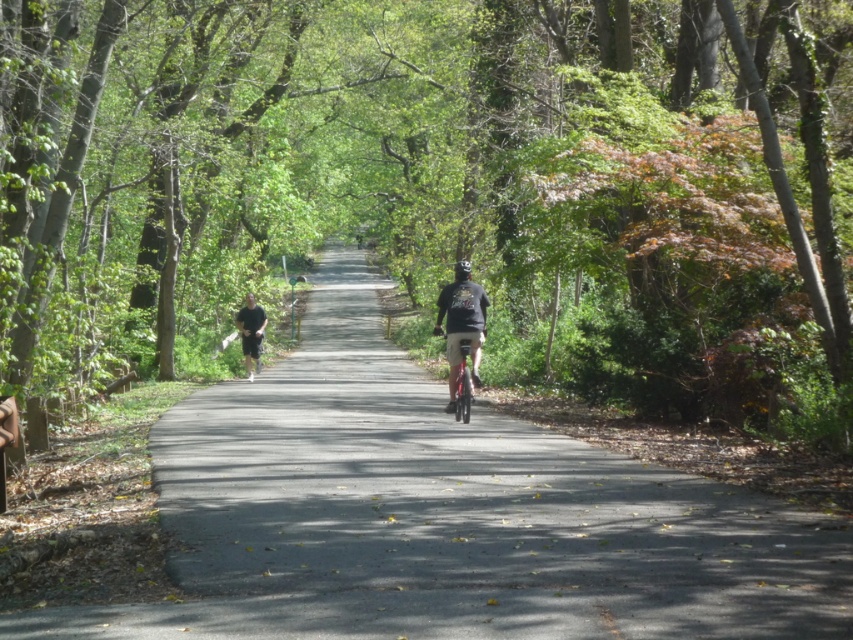
Consider the image. You are a pedestrian walking on the asphalt road at center. You notice a person wearing a dark gray fabric shirt at center ahead of you. Can you see the person clearly due to the lighting conditions?

The asphalt road at center is in front of dark gray fabric shirt at center, so the person wearing the dark gray fabric shirt at center is closer to you. Since the trees create dappled sunlight, it might be harder to see the person clearly if they are in shadowed areas, but their proximity means you can still make out their general form.

You are a hiker walking along the pathway and notice the green leafy tree at center and the black matte shorts at left. Which object is located above the other?

The green leafy tree at center is positioned over black matte shorts at left, meaning the tree is above the shorts.